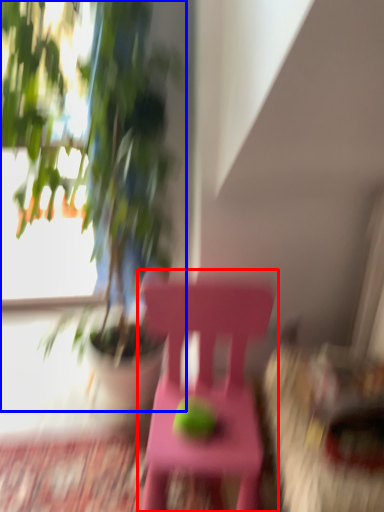
Question: Among these objects, which one is farthest to the camera, chair (highlighted by a red box) or houseplant (highlighted by a blue box)?

Choices:
 (A) chair
 (B) houseplant

Answer: (A)